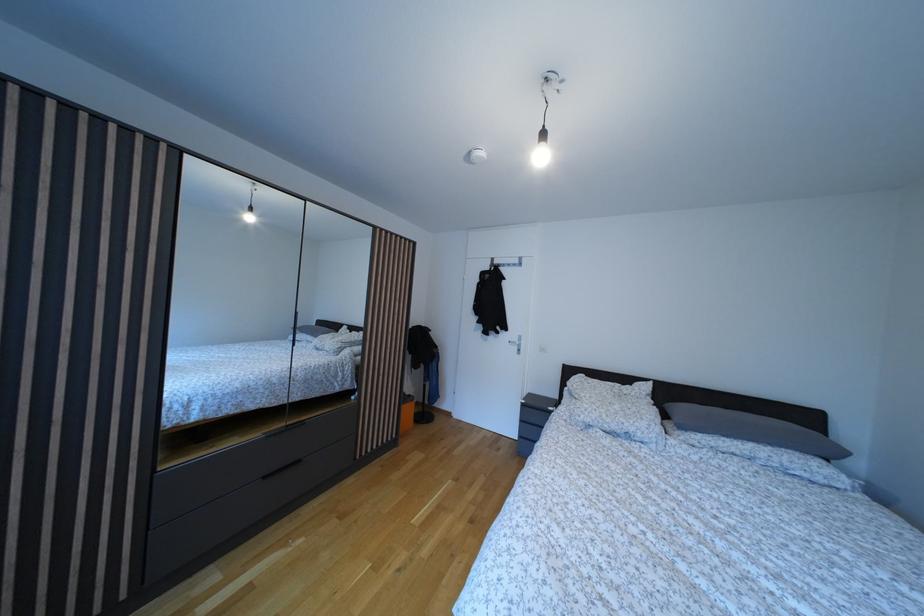
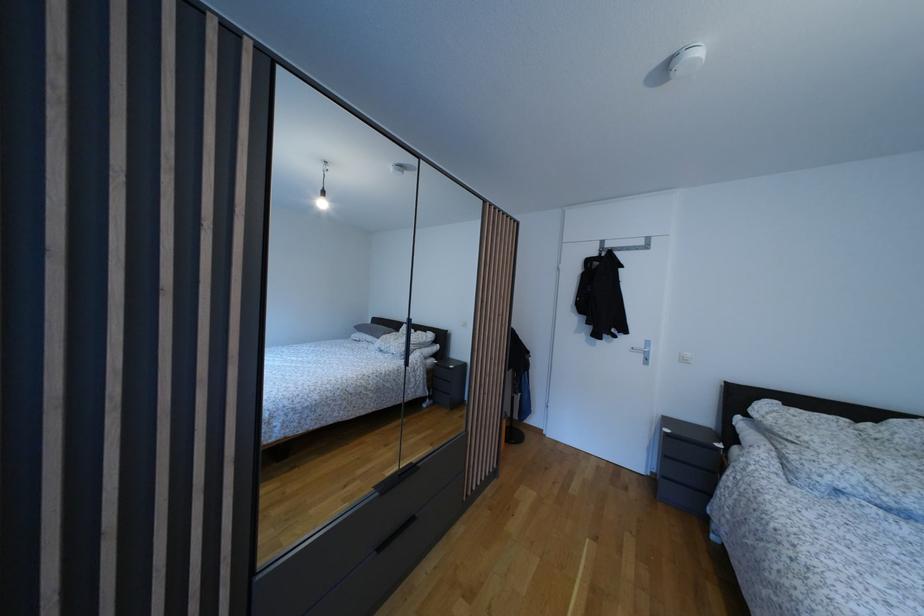
Which direction would the cameraman need to move to produce the second image?

The movement direction of the cameraman is left, forward.